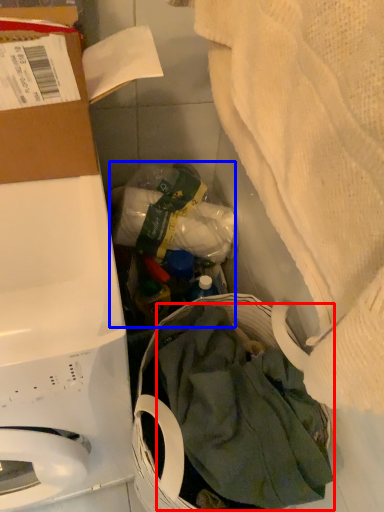
Question: Which point is closer to the camera, clothing (highlighted by a red box) or garbage (highlighted by a blue box)?

Choices:
 (A) clothing
 (B) garbage

Answer: (A)